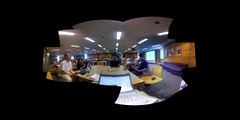
At what (x,y) coordinates should I click in order to perform the action: click on laptop screen. Please return your answer as a coordinate pair (x, y). Looking at the image, I should click on (125, 83).